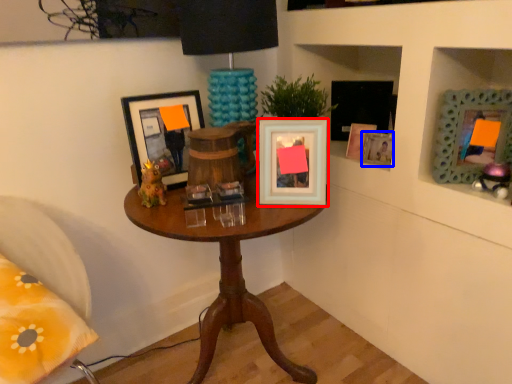
Question: Which point is further to the camera, picture frame (highlighted by a red box) or picture frame (highlighted by a blue box)?

Choices:
 (A) picture frame
 (B) picture frame

Answer: (B)